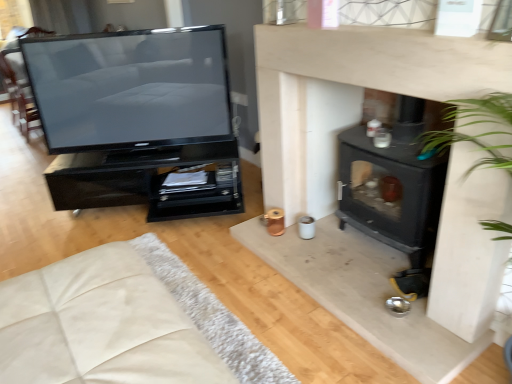
Question: From a real-world perspective, is black glossy tv stand at left positioned over matte black television at left based on gravity?

Choices:
 (A) no
 (B) yes

Answer: (A)

Question: Would you say black glossy tv stand at left is outside matte black television at left?

Choices:
 (A) yes
 (B) no

Answer: (A)

Question: From the image's perspective, is black glossy tv stand at left above matte black television at left?

Choices:
 (A) no
 (B) yes

Answer: (A)

Question: Considering the relative sizes of black glossy tv stand at left and matte black television at left in the image provided, is black glossy tv stand at left thinner than matte black television at left?

Choices:
 (A) no
 (B) yes

Answer: (A)

Question: Could you tell me if black glossy tv stand at left is facing matte black television at left?

Choices:
 (A) yes
 (B) no

Answer: (B)

Question: Is point (82, 99) closer or farther from the camera than point (51, 375)?

Choices:
 (A) farther
 (B) closer

Answer: (A)

Question: Choose the correct answer: Is matte black television at left inside beige fabric couch at lower left or outside it?

Choices:
 (A) outside
 (B) inside

Answer: (A)

Question: Looking at their shapes, would you say matte black television at left is wider or thinner than beige fabric couch at lower left?

Choices:
 (A) thin
 (B) wide

Answer: (A)

Question: Relative to beige fabric couch at lower left, is matte black television at left in front or behind?

Choices:
 (A) front
 (B) behind

Answer: (B)

Question: From a real-world perspective, is black matte wood burning stove at center-right physically located above or below matte black television at left?

Choices:
 (A) below
 (B) above

Answer: (A)

Question: Considering the positions of black matte wood burning stove at center-right and matte black television at left in the image, is black matte wood burning stove at center-right taller or shorter than matte black television at left?

Choices:
 (A) tall
 (B) short

Answer: (A)

Question: From the image's perspective, is black matte wood burning stove at center-right located above or below matte black television at left?

Choices:
 (A) above
 (B) below

Answer: (B)

Question: Considering the positions of black matte wood burning stove at center-right and matte black television at left in the image, is black matte wood burning stove at center-right wider or thinner than matte black television at left?

Choices:
 (A) thin
 (B) wide

Answer: (B)

Question: Considering the positions of black matte wood burning stove at center-right and beige fabric couch at lower left in the image, is black matte wood burning stove at center-right taller or shorter than beige fabric couch at lower left?

Choices:
 (A) tall
 (B) short

Answer: (A)

Question: In terms of width, does black matte wood burning stove at center-right look wider or thinner when compared to beige fabric couch at lower left?

Choices:
 (A) thin
 (B) wide

Answer: (A)